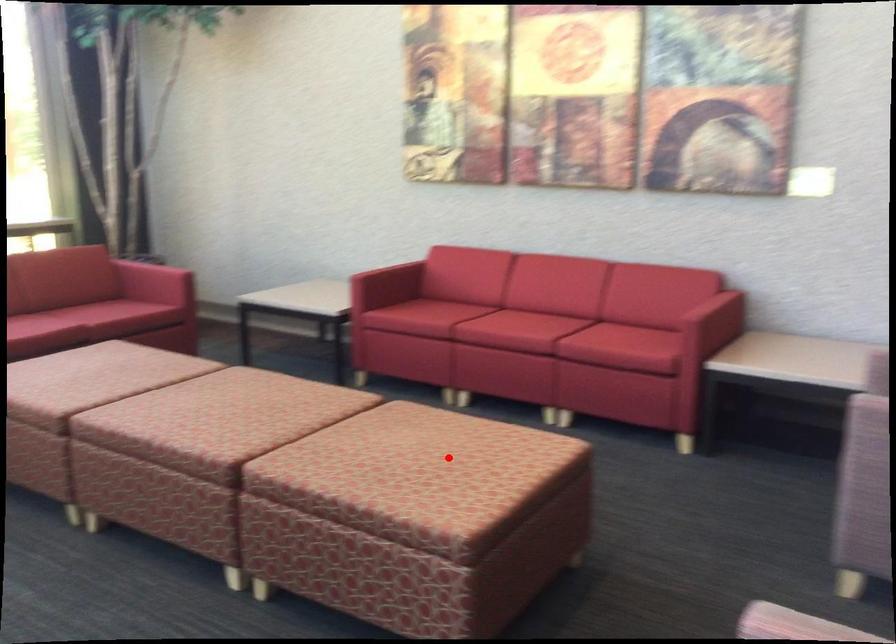
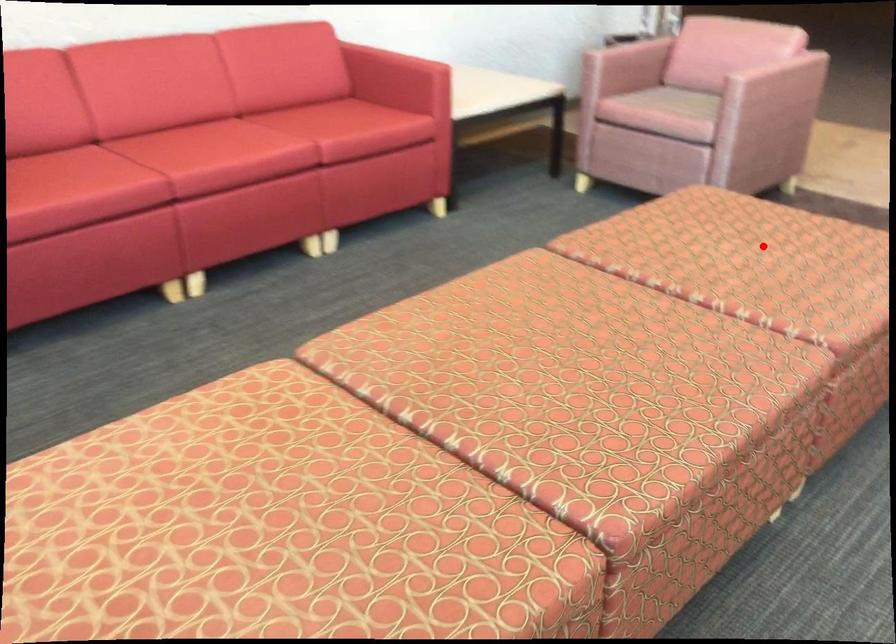
I am providing you with two images of the same scene from different viewpoints. A red point is marked on the first image and another point is marked on the second image. Is the marked point in image1 the same physical position as the marked point in image2?

Yes